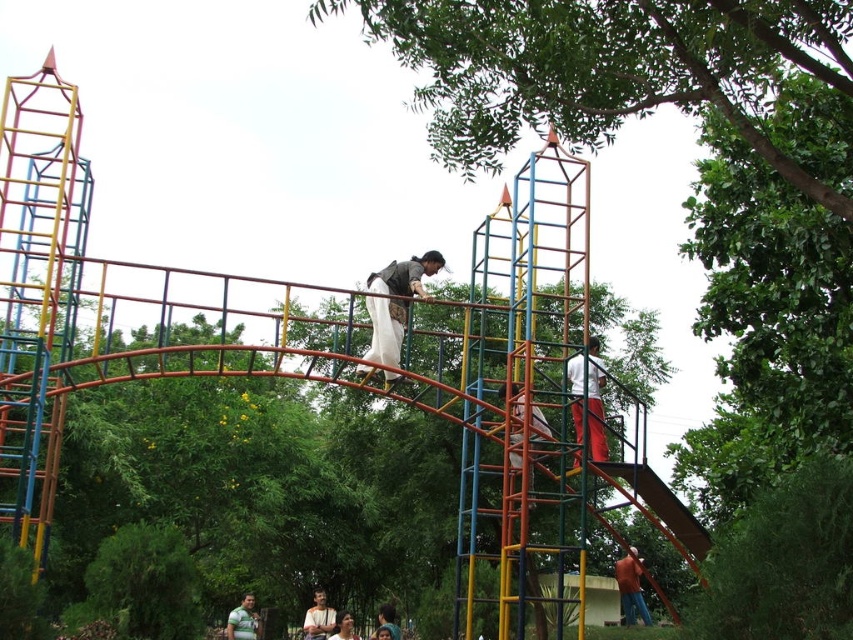
Can you confirm if white cotton pants at center is thinner than metallic silver helmet at upper center?

Yes.

Can you confirm if white cotton pants at center is smaller than metallic silver helmet at upper center?

No.

Which is behind, point (577, 428) or point (546, 429)?

Point (546, 429)

Where is `white cotton pants at center`? This screenshot has width=853, height=640. white cotton pants at center is located at coordinates (595, 403).

I want to click on matte brown vest at center, so click(x=395, y=301).

Which is more to the left, matte brown vest at center or orange cotton shirt at lower right?

matte brown vest at center

Between point (393, 308) and point (635, 596), which one is positioned in front?

Point (393, 308) is in front.

At what (x,y) coordinates should I click in order to perform the action: click on matte brown vest at center. Please return your answer as a coordinate pair (x, y). Looking at the image, I should click on (395, 301).

Is matte brown vest at center below smooth brown shirt at center?

No, matte brown vest at center is not below smooth brown shirt at center.

Can you confirm if matte brown vest at center is smaller than smooth brown shirt at center?

Indeed, matte brown vest at center has a smaller size compared to smooth brown shirt at center.

Which is in front, point (368, 301) or point (322, 593)?

Point (368, 301) is more forward.

Image resolution: width=853 pixels, height=640 pixels. Find the location of `matte brown vest at center`. matte brown vest at center is located at coordinates (395, 301).